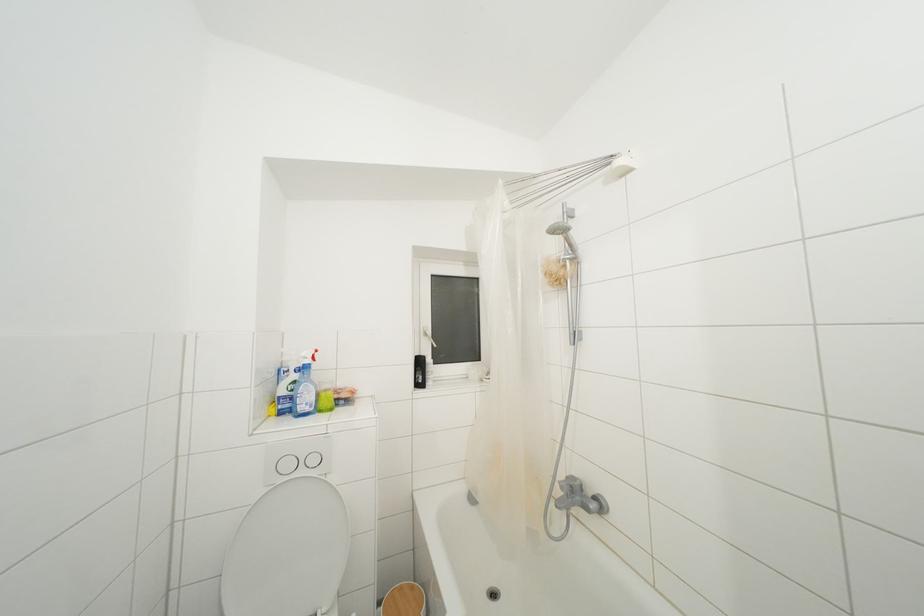
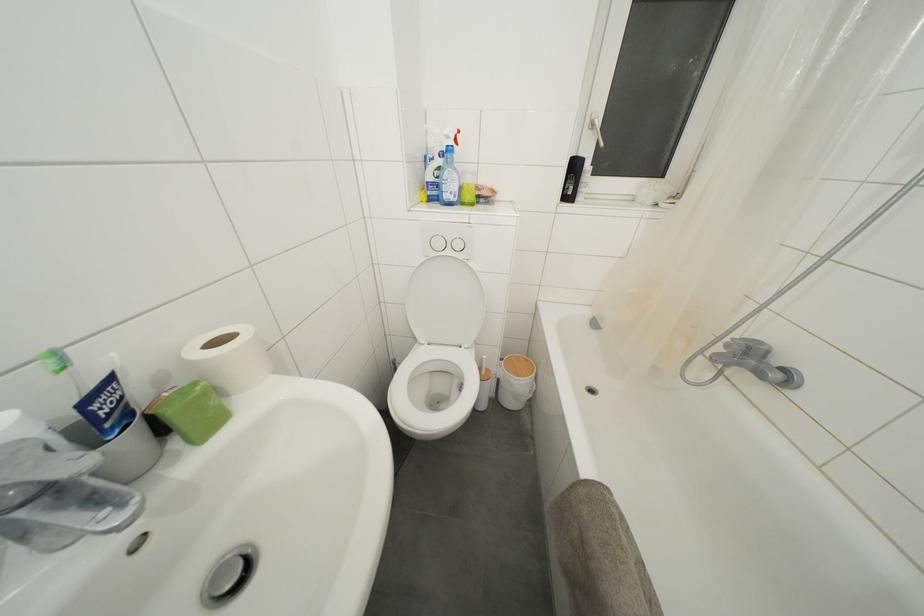
The point at (430, 339) is marked in the first image. Where is the corresponding point in the second image?

(597, 131)